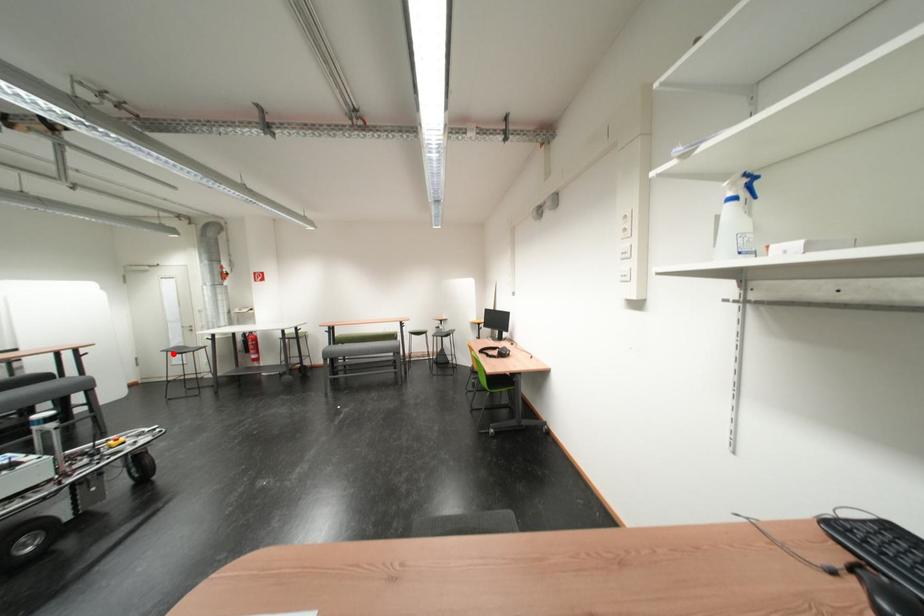
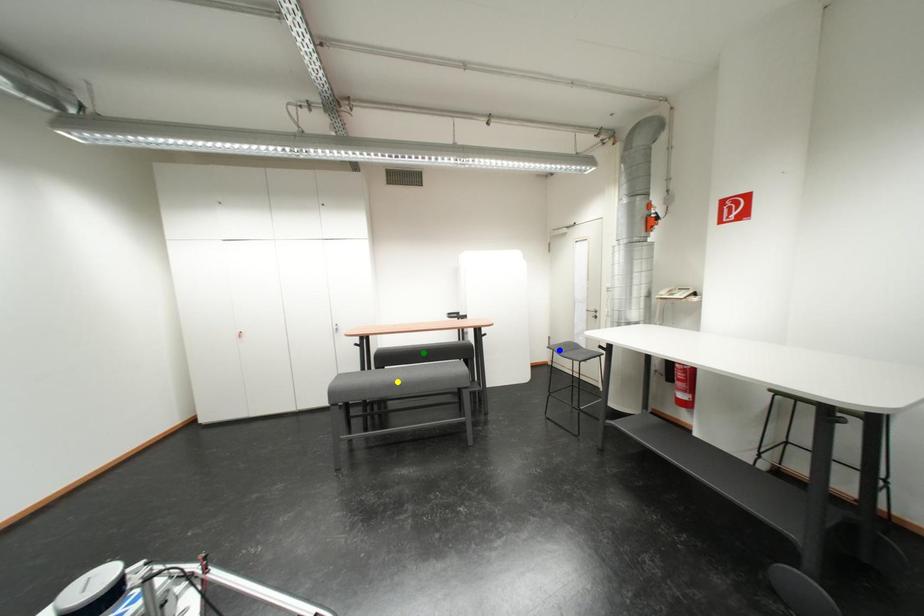
Question: I am providing you with two images of the same scene from different viewpoints. A red point is marked on the first image. You are given multiple points on the second image. Which point in image 2 represents the same 3d spot as the red point in image 1?

Choices:
 (A) yellow point
 (B) green point
 (C) blue point

Answer: (C)